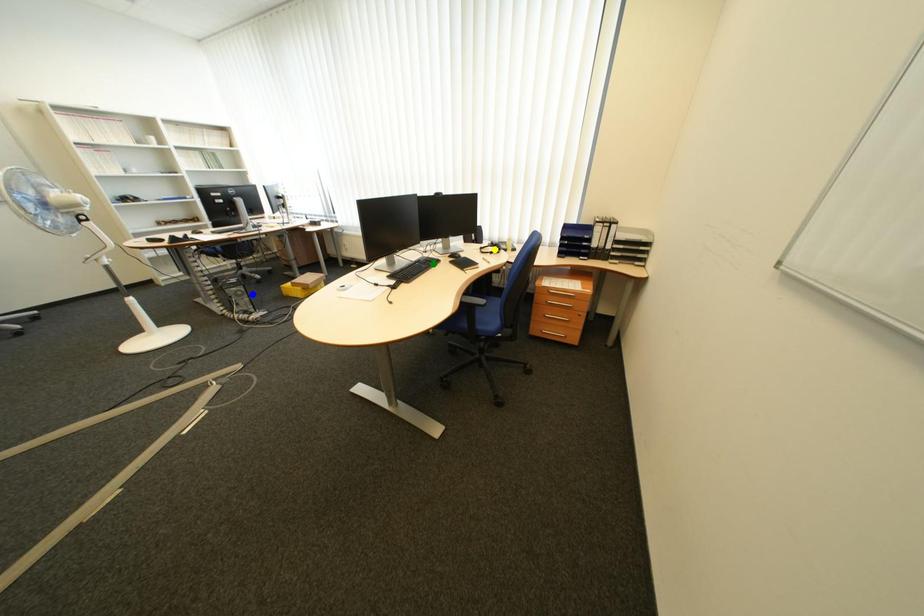
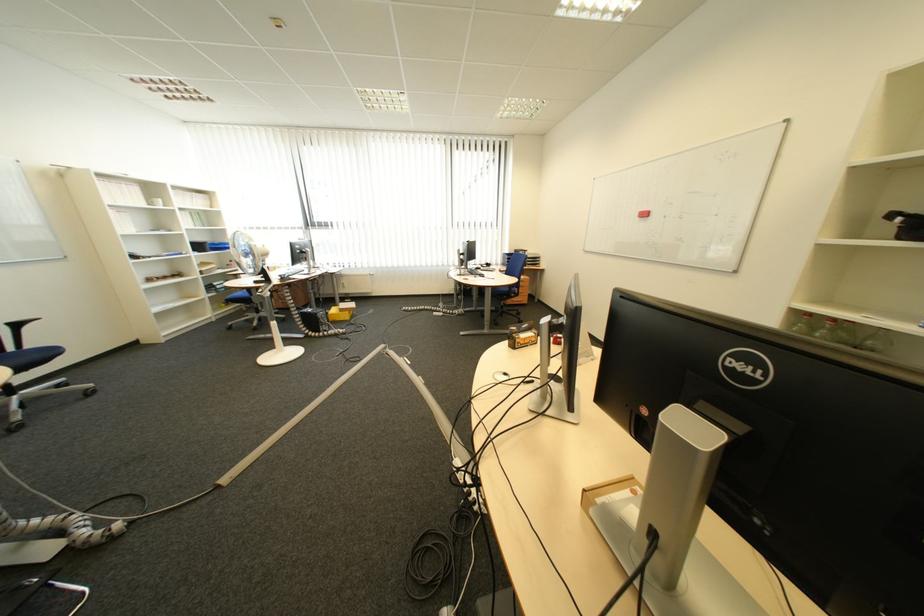
I am providing you with two images of the same scene from different viewpoints. Three points are marked in image1. Which point corresponds to a part or object that is occluded in image2?In image1, three points are marked. Which of them correspond to a part or object that is occluded in image2?Among the three points shown in image1, which one corresponds to a part or object that is no longer visible due to occlusion in image2?

Invisible in image2: green point, yellow point.